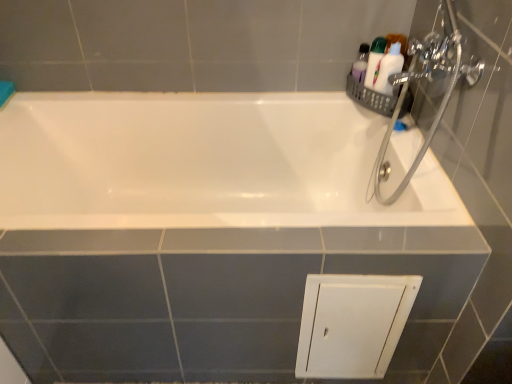
Question: Is white glossy toiletries at upper right, the 1th toiletry in the left-to-right sequence, wider than chrome metallic showerhead at upper right?

Choices:
 (A) yes
 (B) no

Answer: (B)

Question: Is white glossy toiletries at upper right, acting as the 2th toiletry starting from the right, turned away from chrome metallic showerhead at upper right?

Choices:
 (A) no
 (B) yes

Answer: (A)

Question: From a real-world perspective, is white glossy toiletries at upper right, acting as the 2th toiletry starting from the right, located higher than chrome metallic showerhead at upper right?

Choices:
 (A) no
 (B) yes

Answer: (A)

Question: Does white glossy toiletries at upper right, the 1th toiletry in the left-to-right sequence, appear on the right side of chrome metallic showerhead at upper right?

Choices:
 (A) no
 (B) yes

Answer: (A)

Question: From a real-world perspective, does white glossy toiletries at upper right, acting as the 2th toiletry starting from the right, sit lower than chrome metallic showerhead at upper right?

Choices:
 (A) yes
 (B) no

Answer: (A)

Question: Relative to chrome metallic showerhead at upper right, is white glossy toiletries at upper right, acting as the 2th toiletry starting from the right, in front or behind?

Choices:
 (A) front
 (B) behind

Answer: (B)

Question: Is white glossy toiletries at upper right, the 1th toiletry in the left-to-right sequence, wider or thinner than chrome metallic showerhead at upper right?

Choices:
 (A) wide
 (B) thin

Answer: (B)

Question: Is white glossy toiletries at upper right, acting as the 2th toiletry starting from the right, taller or shorter than chrome metallic showerhead at upper right?

Choices:
 (A) short
 (B) tall

Answer: (A)

Question: From the image's perspective, is white glossy toiletries at upper right, the 1th toiletry in the left-to-right sequence, located above or below chrome metallic showerhead at upper right?

Choices:
 (A) above
 (B) below

Answer: (A)

Question: Is white glossy toiletries at upper right, the 1th toiletry in the left-to-right sequence, spatially inside white plastic bottle at upper right, arranged as the first toiletry when viewed from the right, or outside of it?

Choices:
 (A) inside
 (B) outside

Answer: (A)

Question: Is white glossy toiletries at upper right, acting as the 2th toiletry starting from the right, in front of or behind white plastic bottle at upper right, arranged as the first toiletry when viewed from the right, in the image?

Choices:
 (A) front
 (B) behind

Answer: (B)

Question: From a real-world perspective, relative to white plastic bottle at upper right, the 2th toiletry positioned from the left, is white glossy toiletries at upper right, acting as the 2th toiletry starting from the right, vertically above or below?

Choices:
 (A) below
 (B) above

Answer: (A)

Question: Visually, is white glossy toiletries at upper right, acting as the 2th toiletry starting from the right, positioned to the left or to the right of white plastic bottle at upper right, arranged as the first toiletry when viewed from the right?

Choices:
 (A) right
 (B) left

Answer: (B)

Question: In terms of width, does chrome metallic showerhead at upper right look wider or thinner when compared to white glossy toiletries at upper right, acting as the 2th toiletry starting from the right?

Choices:
 (A) wide
 (B) thin

Answer: (A)

Question: Is chrome metallic showerhead at upper right in front of or behind white glossy toiletries at upper right, acting as the 2th toiletry starting from the right, in the image?

Choices:
 (A) behind
 (B) front

Answer: (B)